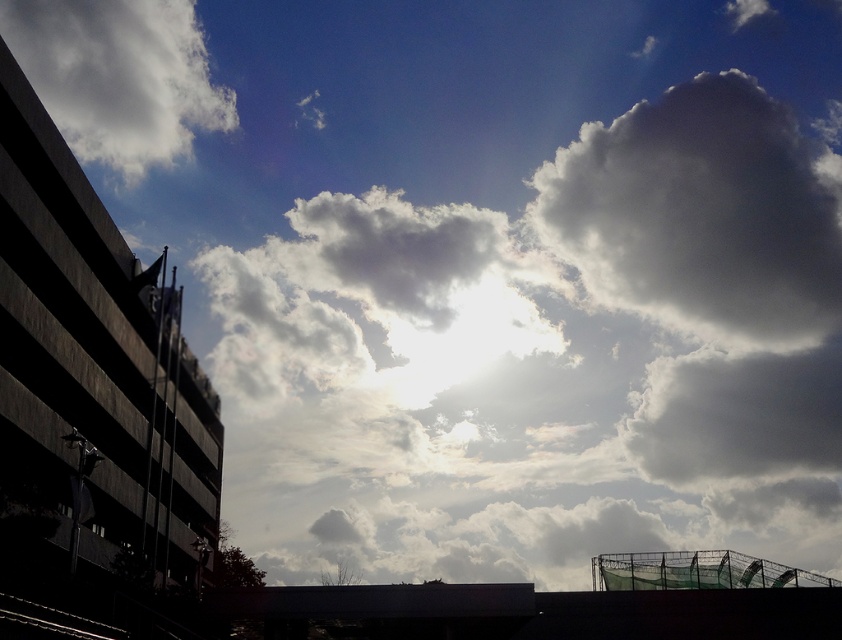
You are an astronomer analyzing the sky scene. You need to determine the coordinates of the white fluffy cloud at upper right in the image. What are its coordinates?

The white fluffy cloud at upper right is located at coordinates point [701,214].

From the picture: You are a bird flying towards the white fluffy cloud at upper left and the green netting at lower right. Which object will you reach first?

The white fluffy cloud at upper left is closer to you than the green netting at lower right, so you will reach the white fluffy cloud at upper left first.

You are an astronomer analyzing this sky scene. You notice two points in the image at coordinates point (659, 291) and point (669, 573). Based on their positions, which point is closer to the bright sun in the sky?

Point (669, 573) is closer to the bright sun in the sky because it is in front of point (659, 291).